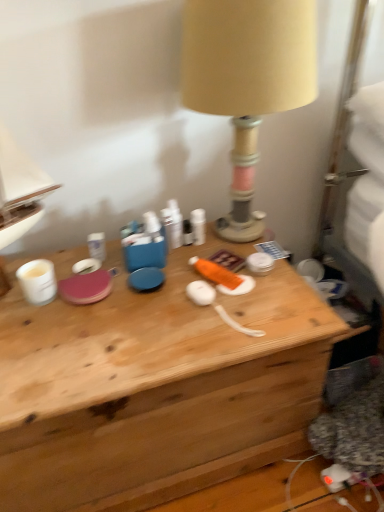
The width and height of the screenshot is (384, 512). Identify the location of vacant region above wooden desk at center (from a real-world perspective). (139, 304).